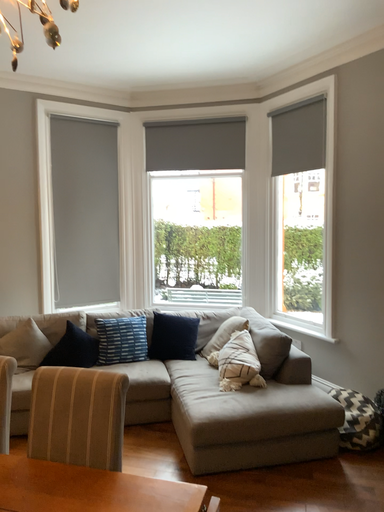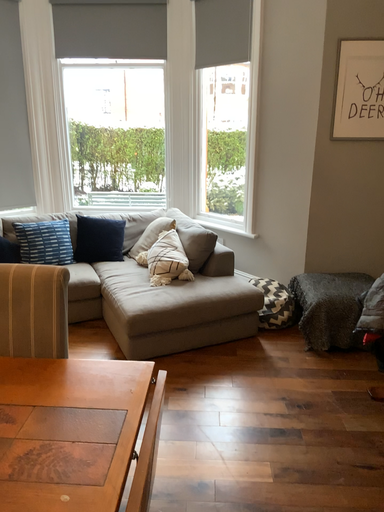
Question: Which way did the camera rotate in the video?

Choices:
 (A) rotated left
 (B) rotated right

Answer: (B)